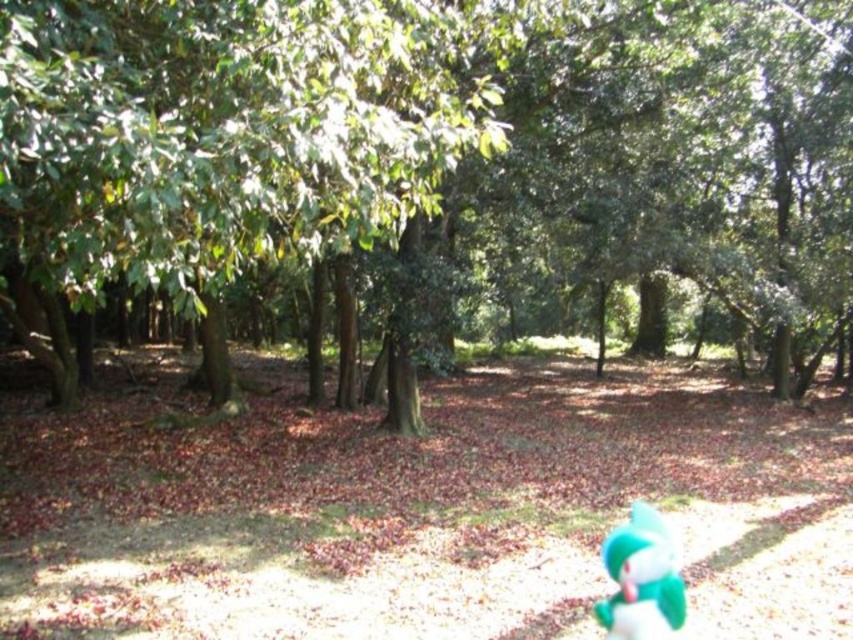
Between point (830, 13) and point (630, 637), which one is positioned behind?

The point (830, 13) is behind.

Between green leafy tree at center and teal plush toy at lower right, which one has more height?

With more height is green leafy tree at center.

Does point (654, 109) come in front of point (648, 609)?

No.

This screenshot has width=853, height=640. In order to click on green leafy tree at center in this screenshot , I will do (428, 163).